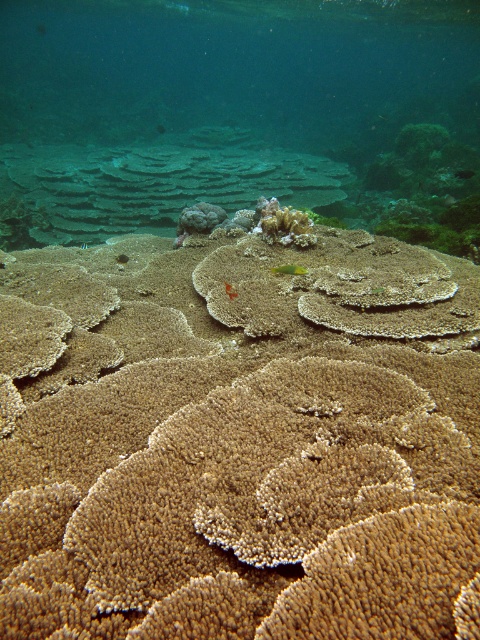
Question: Is brown coral at center smaller than green matte fish at center?

Choices:
 (A) no
 (B) yes

Answer: (A)

Question: Can you confirm if green matte fish at center is positioned above translucent orange fish at center?

Choices:
 (A) no
 (B) yes

Answer: (B)

Question: Which point is closer to the camera?

Choices:
 (A) (226, 289)
 (B) (314, 138)
 (C) (295, 268)
 (D) (430, 520)

Answer: (D)

Question: Is brown textured coral reef at center below translucent orange fish at center?

Choices:
 (A) no
 (B) yes

Answer: (B)

Question: Estimate the real-world distances between objects in this image. Which object is closer to the translucent orange fish at center?

Choices:
 (A) brown coral at center
 (B) brown textured coral reef at center

Answer: (B)

Question: Which object is positioned closest to the brown coral at center?

Choices:
 (A) translucent orange fish at center
 (B) green matte fish at center

Answer: (B)